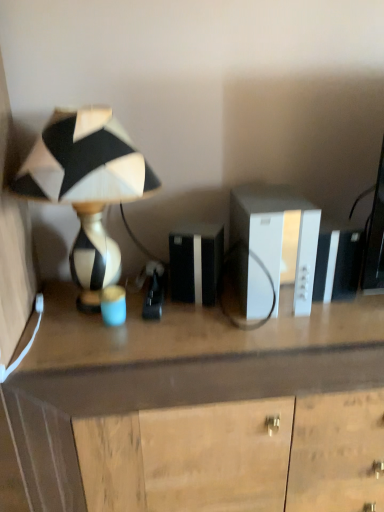
Question: Is black and white ceramic lamp at left wider than wooden desk at center?

Choices:
 (A) yes
 (B) no

Answer: (B)

Question: Would you consider black and white ceramic lamp at left to be distant from wooden desk at center?

Choices:
 (A) no
 (B) yes

Answer: (A)

Question: Is black and white ceramic lamp at left surrounding wooden desk at center?

Choices:
 (A) yes
 (B) no

Answer: (B)

Question: Considering the relative positions of black and white ceramic lamp at left and wooden desk at center in the image provided, is black and white ceramic lamp at left to the left of wooden desk at center from the viewer's perspective?

Choices:
 (A) yes
 (B) no

Answer: (A)

Question: From a real-world perspective, is black and white ceramic lamp at left on wooden desk at center?

Choices:
 (A) no
 (B) yes

Answer: (B)

Question: Relative to wooden desk at center, is white plastic cabinet at center in front or behind?

Choices:
 (A) behind
 (B) front

Answer: (A)

Question: In terms of width, does white plastic cabinet at center look wider or thinner when compared to wooden desk at center?

Choices:
 (A) wide
 (B) thin

Answer: (B)

Question: From a real-world perspective, is white plastic cabinet at center above or below wooden desk at center?

Choices:
 (A) below
 (B) above

Answer: (B)

Question: Which is correct: white plastic cabinet at center is inside wooden desk at center, or outside of it?

Choices:
 (A) inside
 (B) outside

Answer: (B)

Question: From the image's perspective, relative to wooden desk at center, is black and white ceramic lamp at left above or below?

Choices:
 (A) below
 (B) above

Answer: (B)

Question: Looking at the image, does black and white ceramic lamp at left seem bigger or smaller compared to wooden desk at center?

Choices:
 (A) big
 (B) small

Answer: (B)

Question: In the image, is black and white ceramic lamp at left positioned in front of or behind wooden desk at center?

Choices:
 (A) behind
 (B) front

Answer: (B)

Question: In terms of width, does black and white ceramic lamp at left look wider or thinner when compared to wooden desk at center?

Choices:
 (A) thin
 (B) wide

Answer: (A)

Question: Is black and white ceramic lamp at left inside the boundaries of white plastic cabinet at center, or outside?

Choices:
 (A) inside
 (B) outside

Answer: (B)

Question: Would you say black and white ceramic lamp at left is to the left or to the right of white plastic cabinet at center in the picture?

Choices:
 (A) right
 (B) left

Answer: (B)